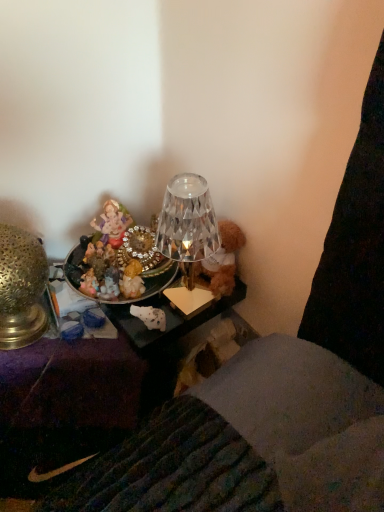
This screenshot has width=384, height=512. I want to click on free spot below gold textured lamp at left (from a real-world perspective), so click(29, 335).